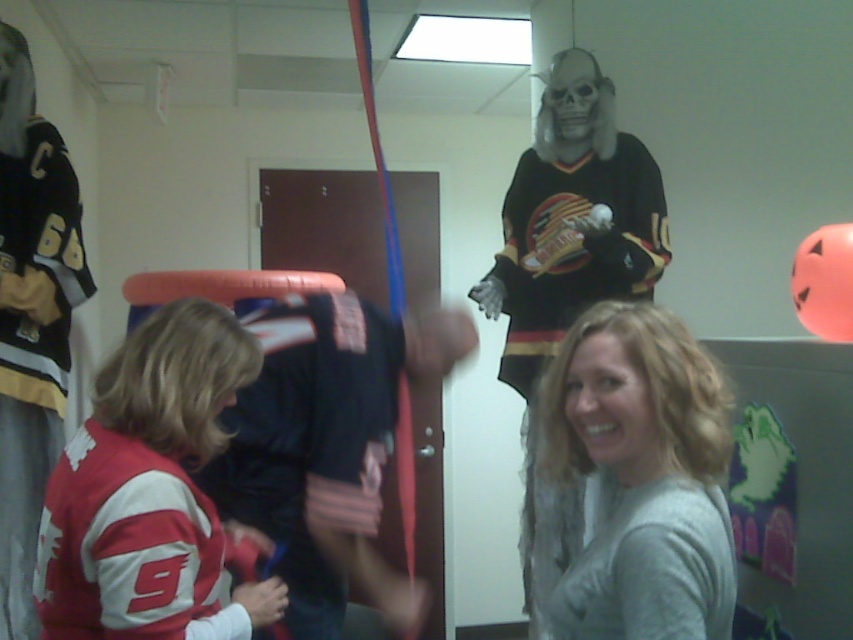
You are organizing a Halloween costume party and need to arrange the dark blue jersey at center and the smooth plastic skull at upper center so that the skull is above the jersey. Is the current arrangement correct?

Yes, the current arrangement is correct because the dark blue jersey at center is positioned under the smooth plastic skull at upper center, which means the skull is above the jersey as required.

You are standing in the room and want to move from the point at coordinates point (376, 312) to the point at coordinates point (587, 116). Since the skeleton is blocking the path, can you go around it by moving to the right side?

Point (376, 312) is in front of point (587, 116), so the skeleton is blocking the path. To go around, you can move to the right side of the skeleton to reach point (587, 116).